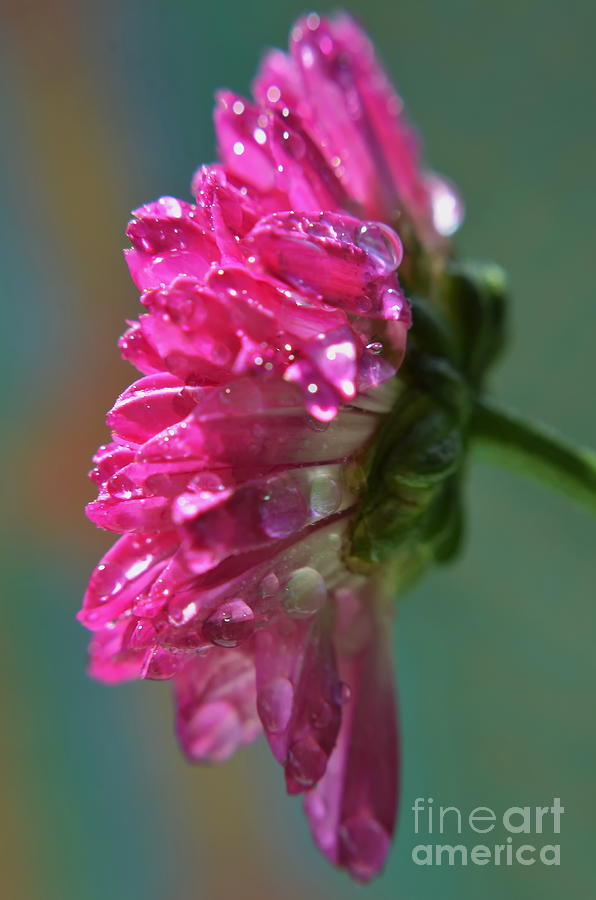
Identify the location of light. This screenshot has height=900, width=596. (342, 349).